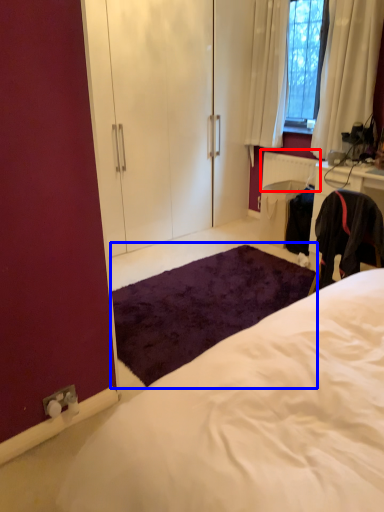
Question: Which of the following is the closest to the observer, radiator (highlighted by a red box) or mat (highlighted by a blue box)?

Choices:
 (A) radiator
 (B) mat

Answer: (B)